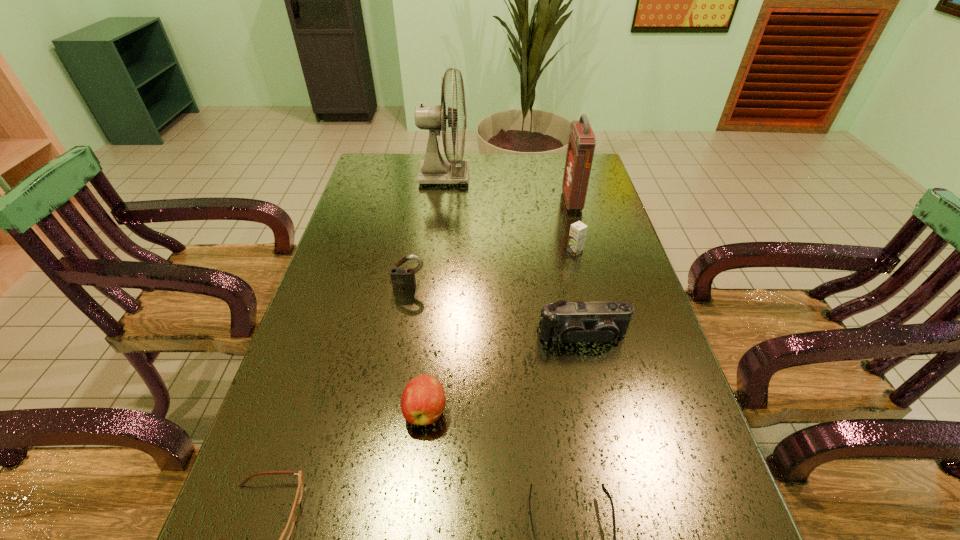
The image size is (960, 540). What are the coordinates of `free region at the right edge of the desktop` in the screenshot? It's located at (617, 262).

The width and height of the screenshot is (960, 540). In order to click on free space at the far left corner of the desktop in this screenshot , I will do `click(392, 161)`.

Locate an element on the screen. This screenshot has height=540, width=960. vacant area at the far right corner of the desktop is located at coordinates (552, 163).

In order to click on free space between the fourth farthest object and the fourth nearest object in this screenshot , I will do `click(496, 312)`.

Image resolution: width=960 pixels, height=540 pixels. I want to click on vacant area between the padlock and the camcorder, so [496, 312].

This screenshot has width=960, height=540. What are the coordinates of `empty space that is in between the camcorder and the tallest object` in the screenshot? It's located at (514, 256).

The width and height of the screenshot is (960, 540). In order to click on free spot between the fifth nearest object and the fifth farthest object in this screenshot , I will do tap(496, 312).

Find the location of `unoccupied area between the first-aid kit and the tallest object`. unoccupied area between the first-aid kit and the tallest object is located at coordinates point(508,188).

At what (x,y) coordinates should I click in order to perform the action: click on free spot between the sixth nearest object and the fan. Please return your answer as a coordinate pair (x, y). Looking at the image, I should click on (510, 214).

The image size is (960, 540). In order to click on free space between the fan and the fifth nearest object in this screenshot , I will do `click(427, 232)`.